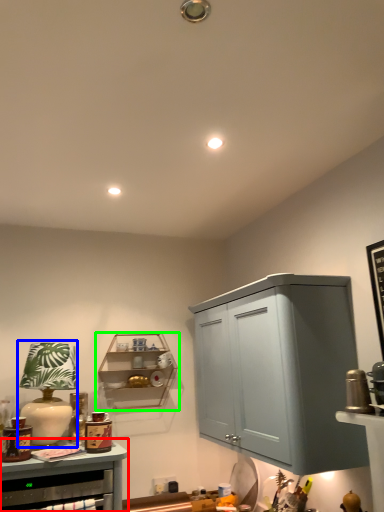
Question: Based on their relative distances, which object is farther from cabinetry (highlighted by a red box)? Choose from table lamp (highlighted by a blue box) and shelf (highlighted by a green box).

Choices:
 (A) table lamp
 (B) shelf

Answer: (B)